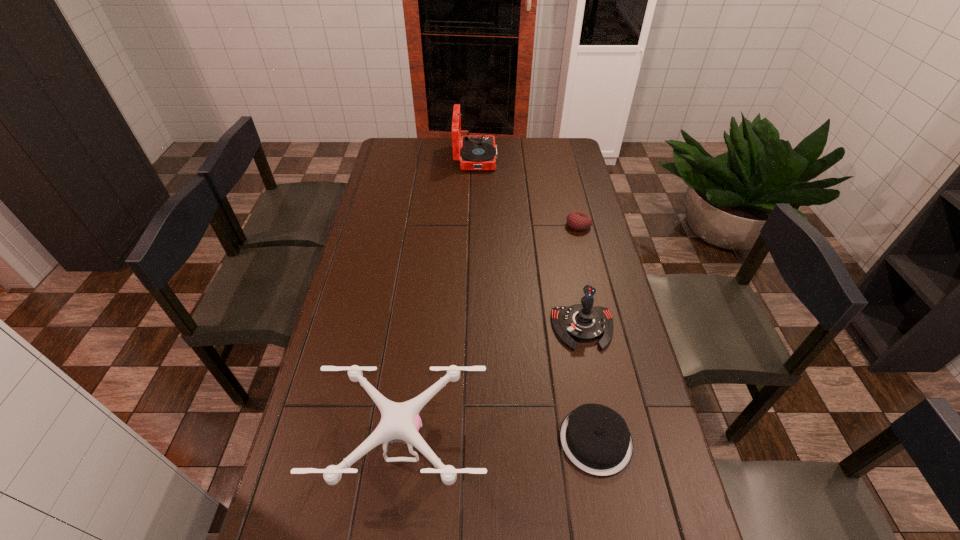
The image size is (960, 540). I want to click on free space in the image that satisfies the following two spatial constraints: 1. on the front-facing side of the pancake; 2. on the left side of the tallest object, so click(472, 441).

Find the location of a particular element. This screenshot has width=960, height=540. vacant space that satisfies the following two spatial constraints: 1. on the front-facing side of the farthest object; 2. on the top of the drone is located at coordinates (472, 442).